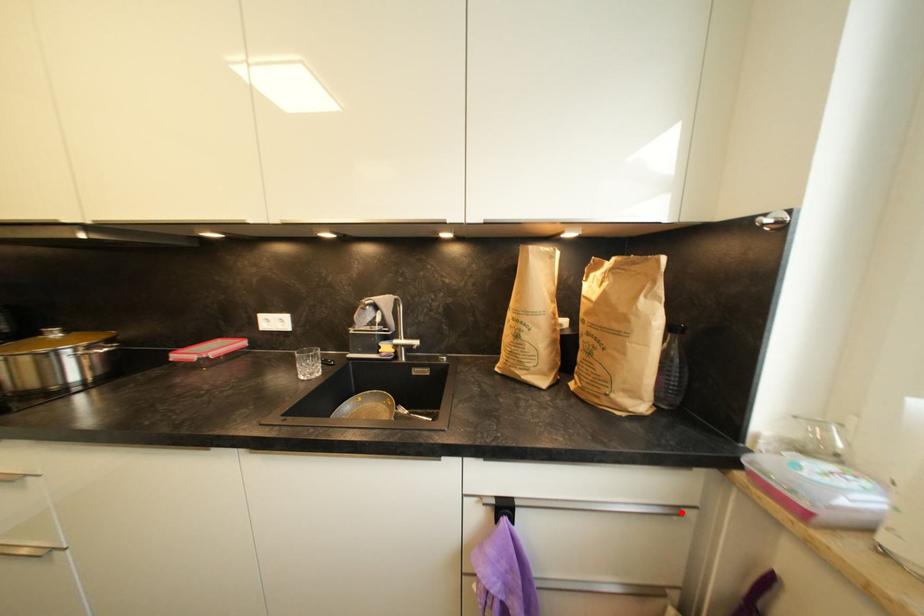
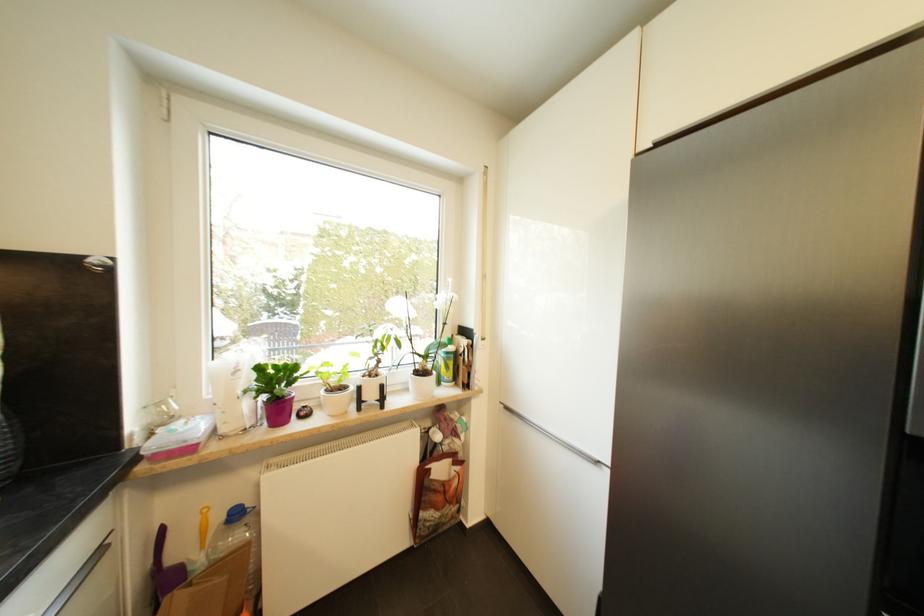
Question: A red point is marked in image1. In image2, is the corresponding 3D point closer to the camera or farther? Reply with the corresponding letter.

Choices:
 (A) The corresponding 3D point is closer.
 (B) The corresponding 3D point is farther.

Answer: (B)